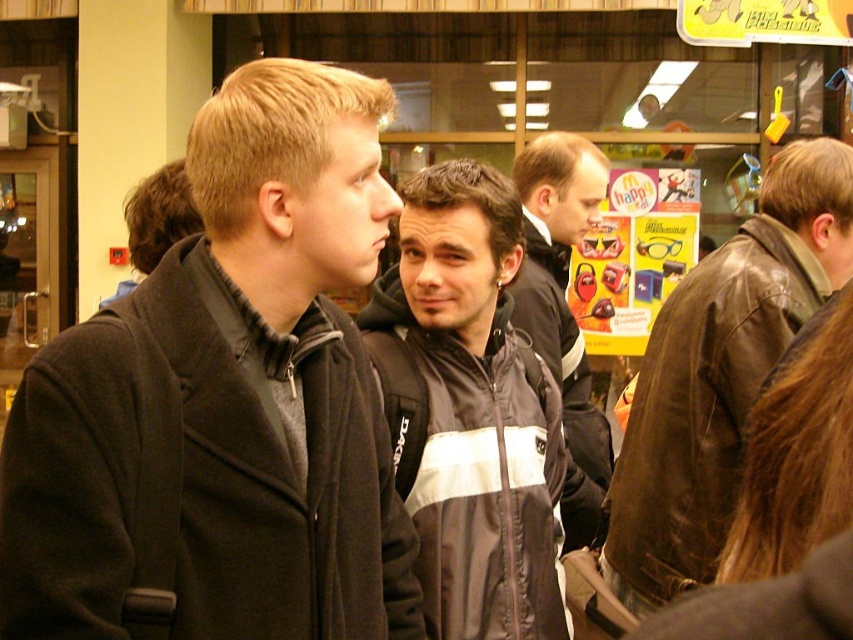
Can you confirm if black and white nylon jacket at center is thinner than dark gray jacket at center?

Incorrect, black and white nylon jacket at center's width is not less than dark gray jacket at center's.

The image size is (853, 640). What do you see at coordinates (473, 468) in the screenshot?
I see `black and white nylon jacket at center` at bounding box center [473, 468].

In order to click on black and white nylon jacket at center in this screenshot , I will do `click(473, 468)`.

Does dark gray woolen jacket at center have a lesser height compared to dark gray jacket at center?

Indeed, dark gray woolen jacket at center has a lesser height compared to dark gray jacket at center.

Locate an element on the screen. dark gray woolen jacket at center is located at coordinates (202, 476).

Where is `dark gray woolen jacket at center`? This screenshot has width=853, height=640. dark gray woolen jacket at center is located at coordinates (202, 476).

Is dark gray woolen jacket at center positioned behind brown leather jacket at right?

No.

Measure the distance from dark gray woolen jacket at center to brown leather jacket at right.

dark gray woolen jacket at center is 1.18 meters away from brown leather jacket at right.

Where is `dark gray woolen jacket at center`? The width and height of the screenshot is (853, 640). dark gray woolen jacket at center is located at coordinates (202, 476).